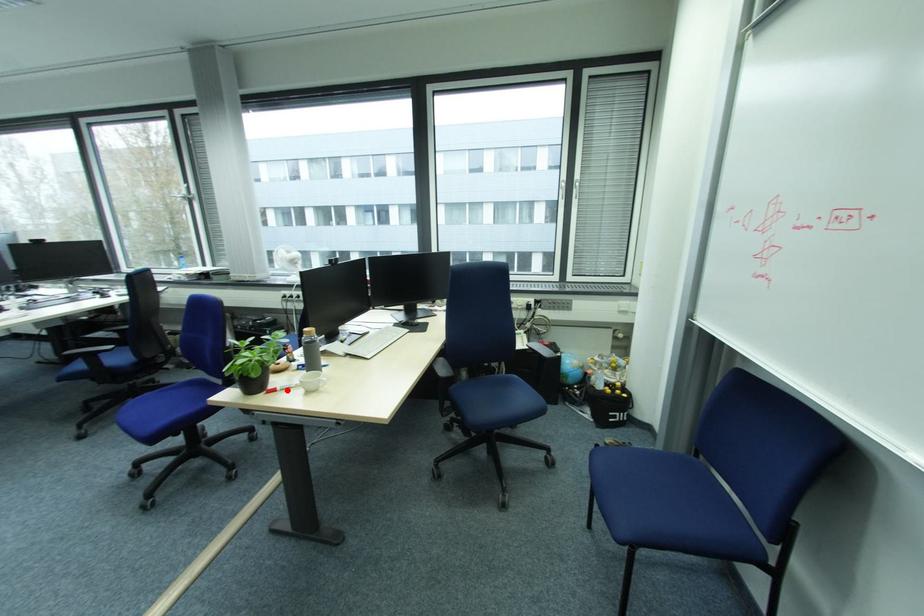
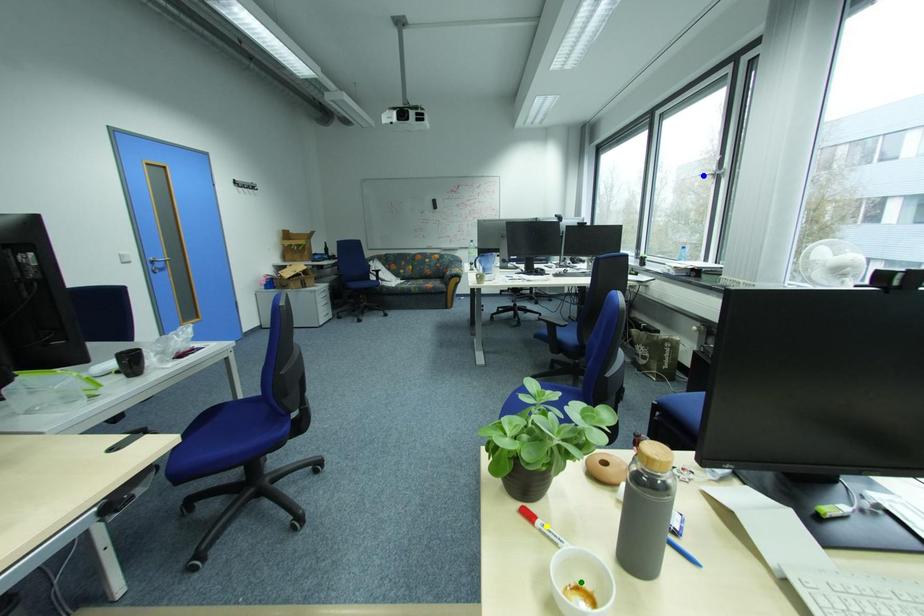
Question: I am providing you with two images of the same scene from different viewpoints. A red point is marked on the first image. You are given multiple points on the second image. Which point in image 2 represents the same 3d spot as the red point in image 1?

Choices:
 (A) green point
 (B) blue point
 (C) yellow point

Answer: (C)